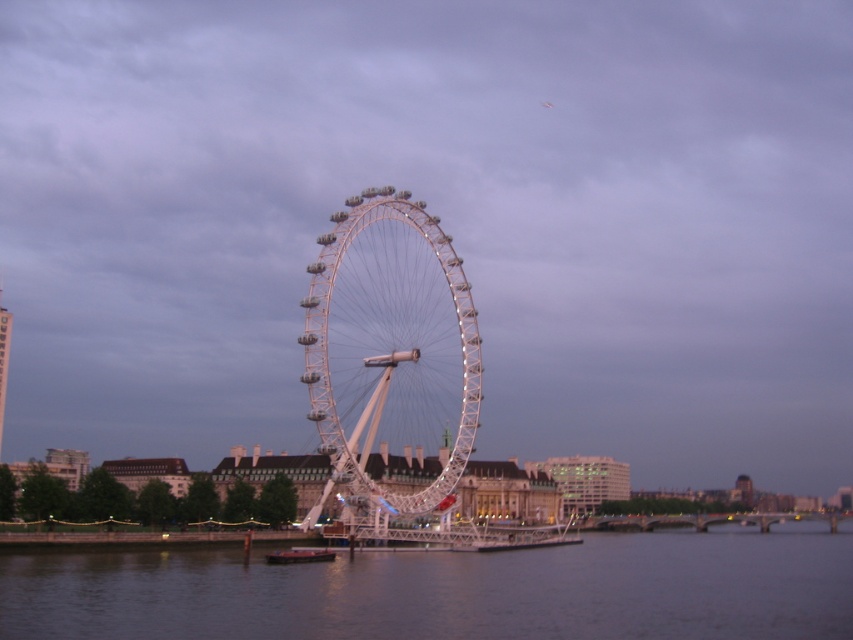
You are standing at the point with coordinates point (x=390, y=358). Looking around, you see the white metallic ferris wheel at center. Which direction should you face to see the ferris wheel?

Since you are standing at the point where the white metallic ferris wheel at center is located, you would need to look around yourself in any direction to see it, as you are already at its location.

You are standing at the base of the white metallic ferris wheel at center. If you walk straight ahead, will you eventually reach the River Thames?

Yes, the white metallic ferris wheel at center is situated by the River Thames, so walking straight ahead from its base would lead you towards the river.

You are standing on the Southbank Centre and looking at the dark blue water at center and the white metallic ferris wheel at center. Which object appears taller from your vantage point?

The white metallic ferris wheel at center appears taller than the dark blue water at center because the dark blue water at center is shorter than the white metallic ferris wheel at center.